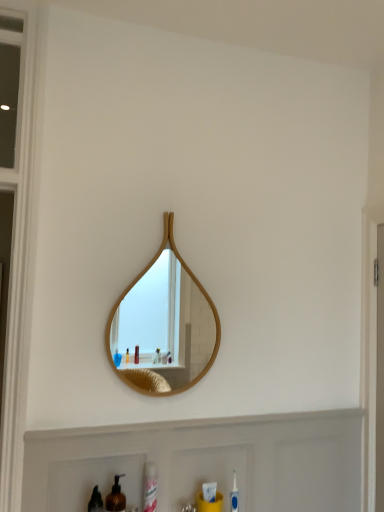
Question: From a real-world perspective, is wooden mirror at center physically located above or below white glossy spray can at lower center?

Choices:
 (A) below
 (B) above

Answer: (B)

Question: Based on their positions, is wooden mirror at center located to the left or right of white glossy spray can at lower center?

Choices:
 (A) left
 (B) right

Answer: (B)

Question: Estimate the real-world distances between objects in this image. Which object is closer to the brown matte bottle at lower left?

Choices:
 (A) white glossy spray can at lower center
 (B) white matte cabinet at lower center
 (C) wooden mirror at center

Answer: (A)

Question: Estimate the real-world distances between objects in this image. Which object is closer to the wooden mirror at center?

Choices:
 (A) white matte cabinet at lower center
 (B) white glossy spray can at lower center
 (C) brown matte bottle at lower left

Answer: (A)